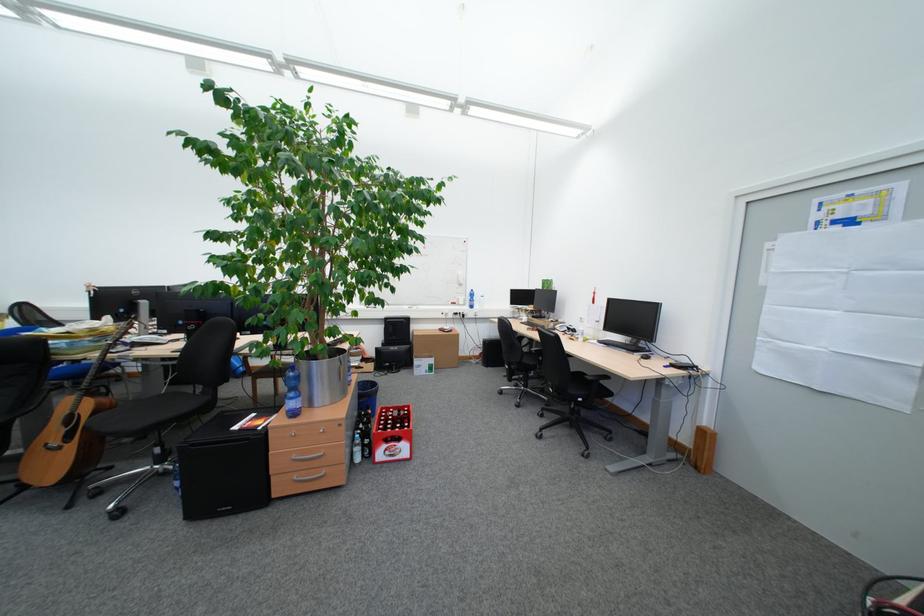
Where is `cardboard box`? cardboard box is located at coordinates (436, 346).